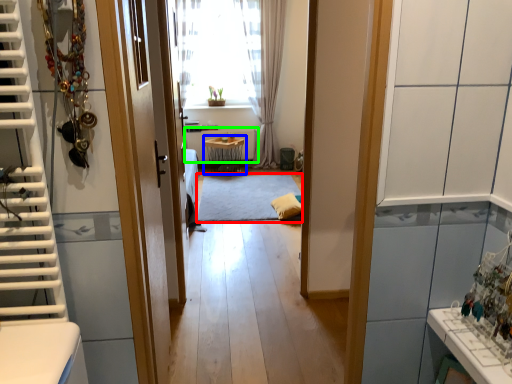
Question: Considering the real-world distances, which object is farthest from mat (highlighted by a red box)? table (highlighted by a blue box) or radiator (highlighted by a green box)?

Choices:
 (A) table
 (B) radiator

Answer: (B)